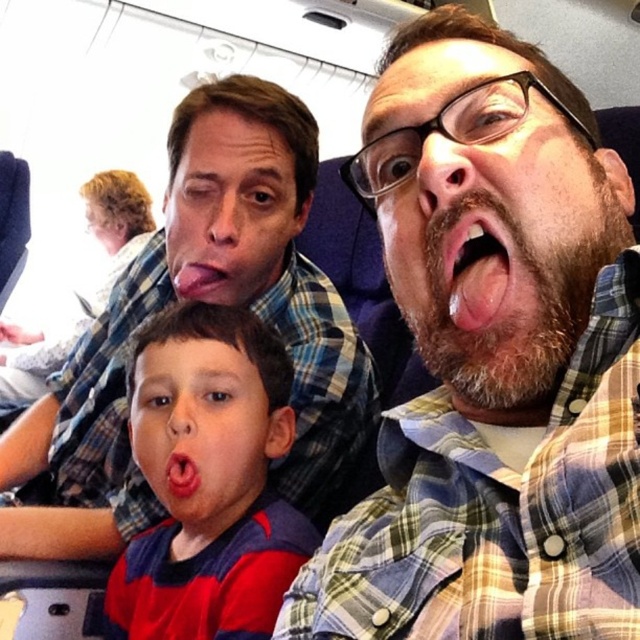
Consider the image. Between plaid shirt at center and red plaid shirt at center, which one has more height?

With more height is plaid shirt at center.

Between point (513, 371) and point (262, 337), which one is positioned behind?

The point (262, 337) is more distant.

This screenshot has width=640, height=640. In order to click on plaid shirt at center in this screenshot , I will do `click(493, 365)`.

Can you confirm if matte plaid shirt at upper center is taller than red plaid shirt at center?

Yes.

Does matte plaid shirt at upper center appear on the right side of red plaid shirt at center?

Incorrect, matte plaid shirt at upper center is not on the right side of red plaid shirt at center.

Where is `matte plaid shirt at upper center`? This screenshot has height=640, width=640. matte plaid shirt at upper center is located at coordinates (205, 301).

Can you confirm if matte plaid shirt at upper center is taller than pink glossy tongue at center?

Correct, matte plaid shirt at upper center is much taller as pink glossy tongue at center.

Between matte plaid shirt at upper center and pink glossy tongue at center, which one appears on the right side from the viewer's perspective?

pink glossy tongue at center

This screenshot has width=640, height=640. I want to click on matte plaid shirt at upper center, so point(205,301).

Where is `matte plaid shirt at upper center`? The image size is (640, 640). matte plaid shirt at upper center is located at coordinates (205, 301).